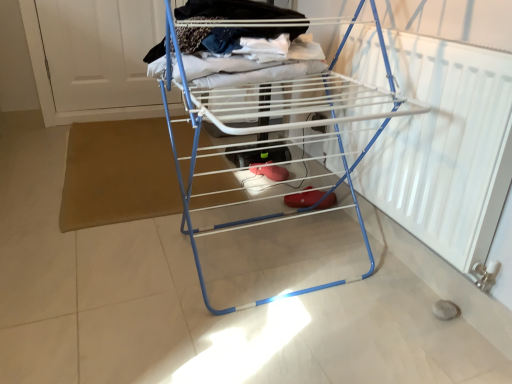
Question: Is point (178, 28) positioned closer to the camera than point (143, 9)?

Choices:
 (A) farther
 (B) closer

Answer: (B)

Question: From the image's perspective, is blue metal drying rack at center above or below white matte door at upper left?

Choices:
 (A) below
 (B) above

Answer: (A)

Question: Considering the positions of blue metal drying rack at center and white matte door at upper left in the image, is blue metal drying rack at center wider or thinner than white matte door at upper left?

Choices:
 (A) wide
 (B) thin

Answer: (A)

Question: From a real-world perspective, is white matte door at upper left above or below blue metal drying rack at center?

Choices:
 (A) below
 (B) above

Answer: (A)

Question: Is white matte door at upper left wider or thinner than blue metal drying rack at center?

Choices:
 (A) thin
 (B) wide

Answer: (A)

Question: Considering the positions of point (62, 59) and point (329, 134), is point (62, 59) closer or farther from the camera than point (329, 134)?

Choices:
 (A) closer
 (B) farther

Answer: (B)

Question: Is white matte door at upper left bigger or smaller than blue metal drying rack at center?

Choices:
 (A) big
 (B) small

Answer: (B)